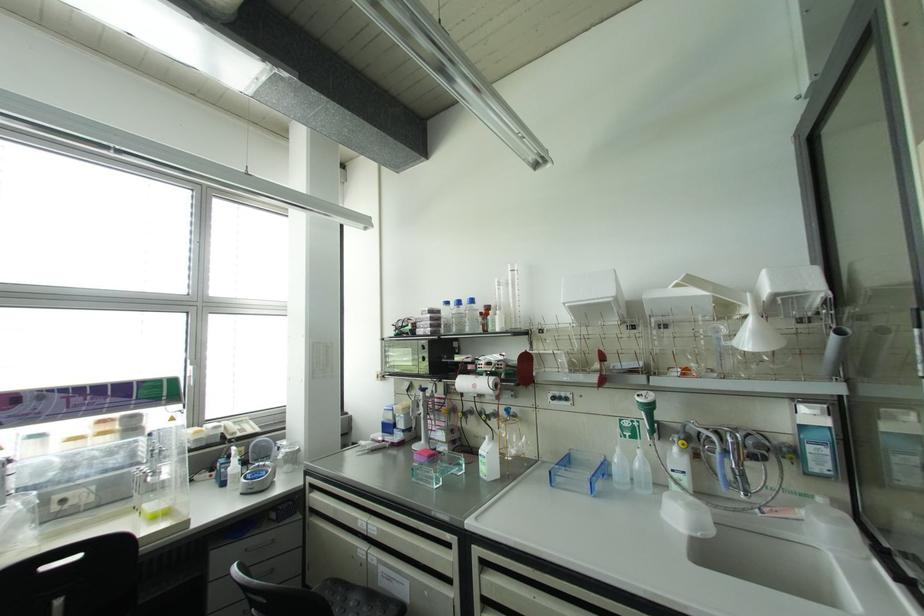
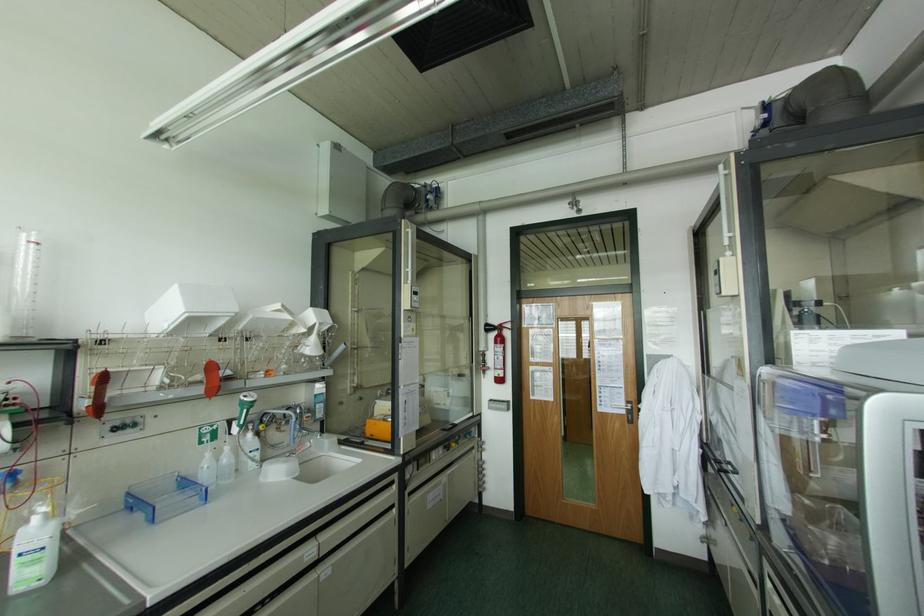
Where in the second image is the point corresponding to point (491, 445) from the first image?

(53, 523)